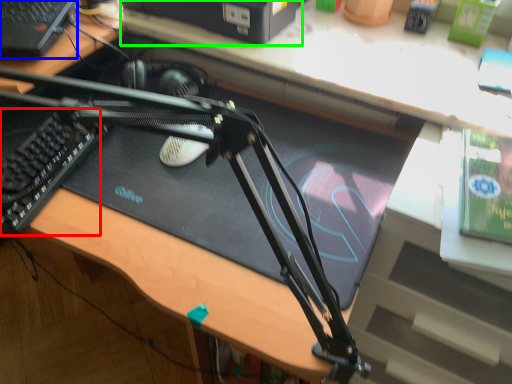
Question: Which is farther away from laptop keyboard (highlighted by a red box)? computer (highlighted by a blue box) or computer (highlighted by a green box)?

Choices:
 (A) computer
 (B) computer

Answer: (B)